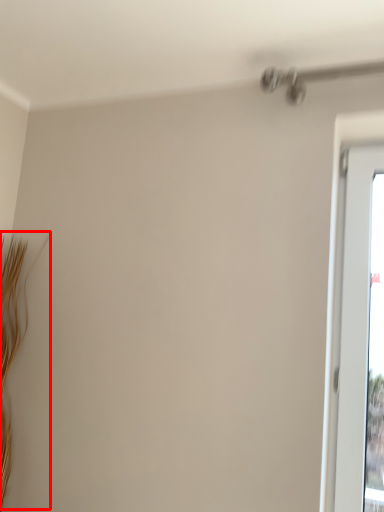
Question: Observing the image, what is the correct spatial positioning of twig (annotated by the red box) in reference to window screen?

Choices:
 (A) left
 (B) right

Answer: (A)